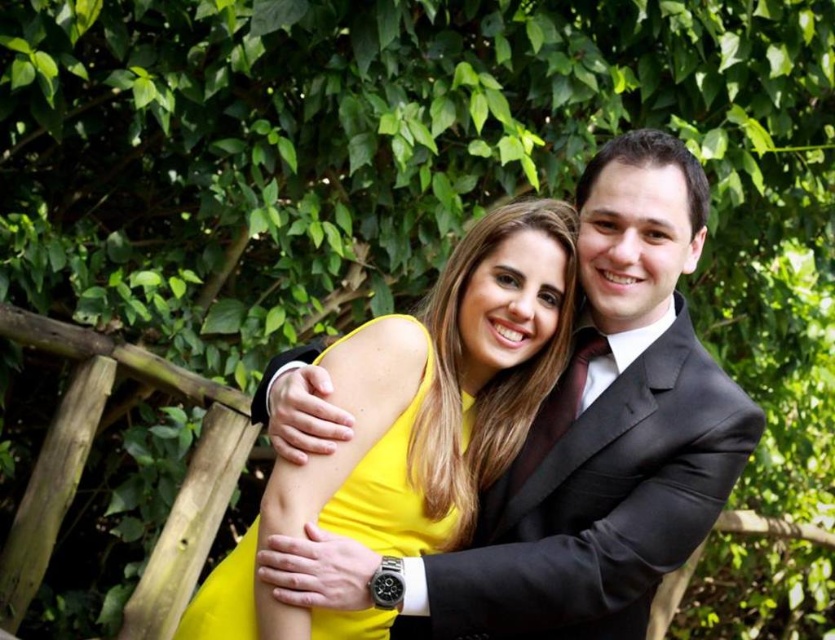
Question: Is shiny black suit at center to the left of yellow satin dress at center from the viewer's perspective?

Choices:
 (A) no
 (B) yes

Answer: (A)

Question: Which of the following is the closest to the observer?

Choices:
 (A) (423, 392)
 (B) (557, 566)
 (C) (672, 481)

Answer: (B)

Question: Observing the image, what is the correct spatial positioning of shiny black suit at center in reference to yellow satin dress at center?

Choices:
 (A) right
 (B) left

Answer: (A)

Question: From the image, what is the correct spatial relationship of shiny black suit at center in relation to yellow satin dress at center?

Choices:
 (A) above
 (B) below

Answer: (A)

Question: Which object is the closest to the yellow satin dress at center?

Choices:
 (A) shiny black suit at center
 (B) satin black suit at center

Answer: (A)

Question: Estimate the real-world distances between objects in this image. Which object is farther from the yellow satin dress at center?

Choices:
 (A) shiny black suit at center
 (B) satin black suit at center

Answer: (B)